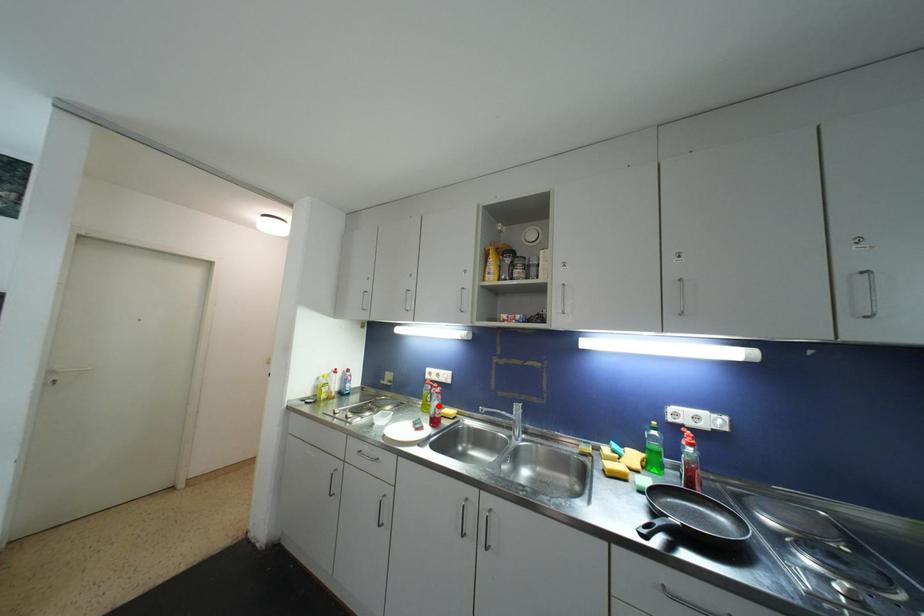
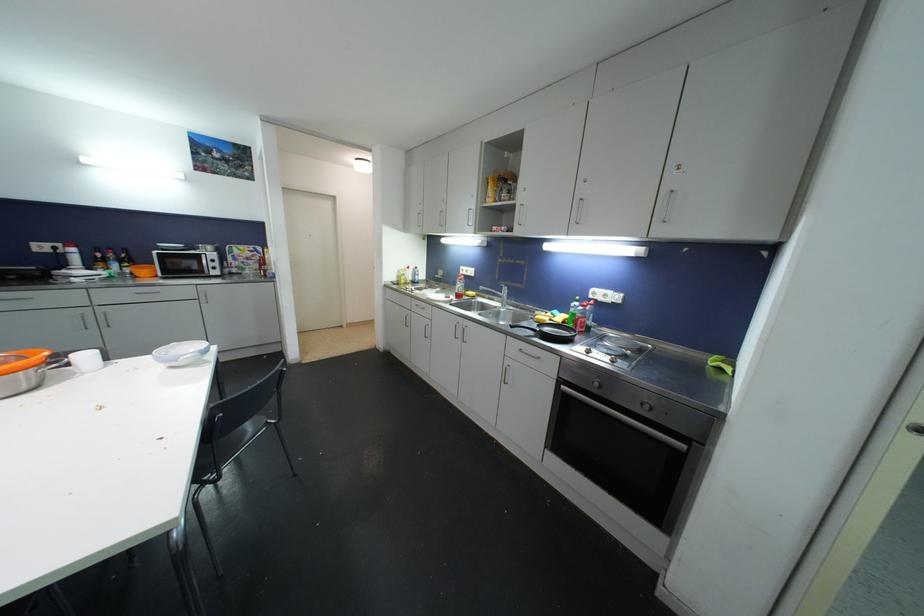
Question: I am providing you with two images of the same scene from different viewpoints. A red point is shown in image1. For the corresponding object point in image2, is it positioned nearer or farther from the camera?

Choices:
 (A) Nearer
 (B) Farther

Answer: (A)